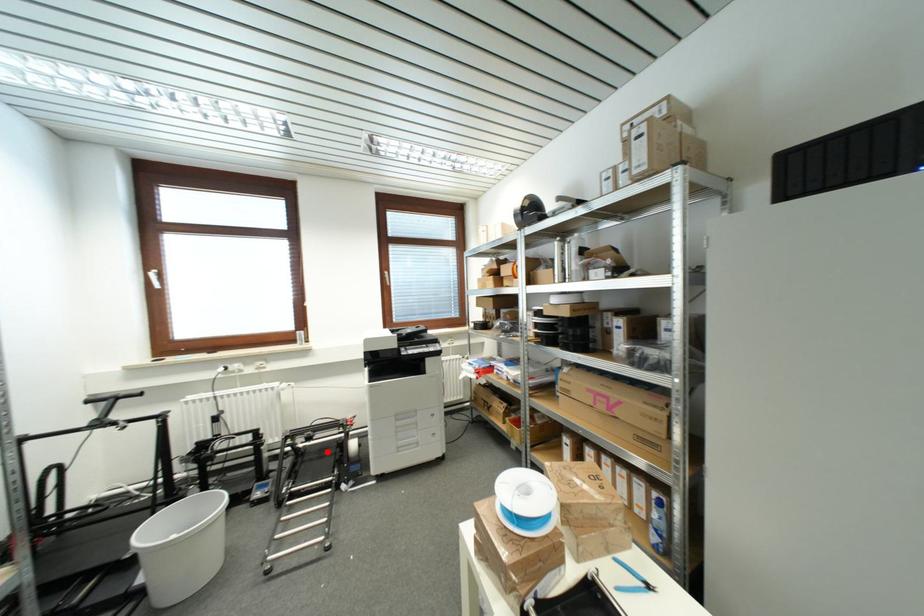
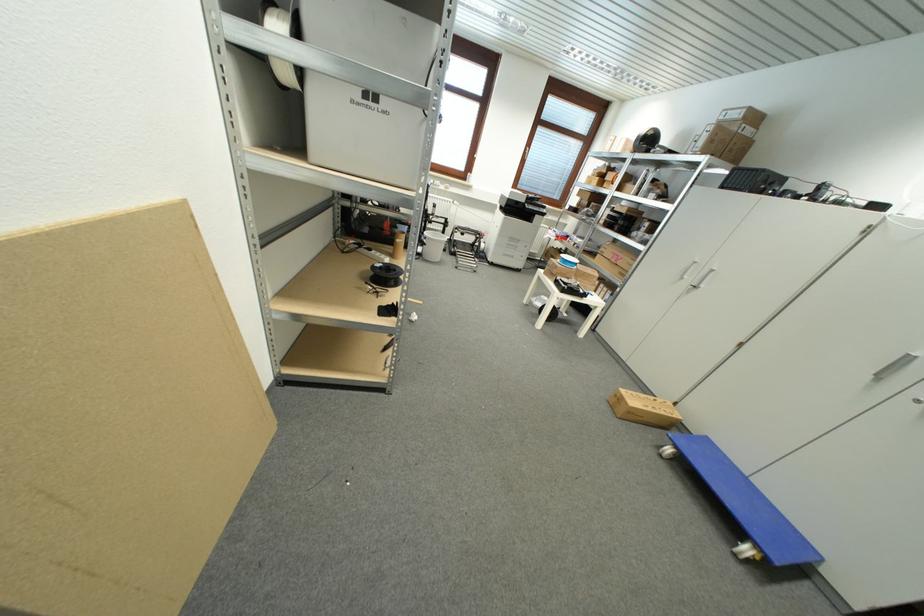
Locate, in the second image, the point that corresponds to the highlighted location in the first image.

(468, 246)